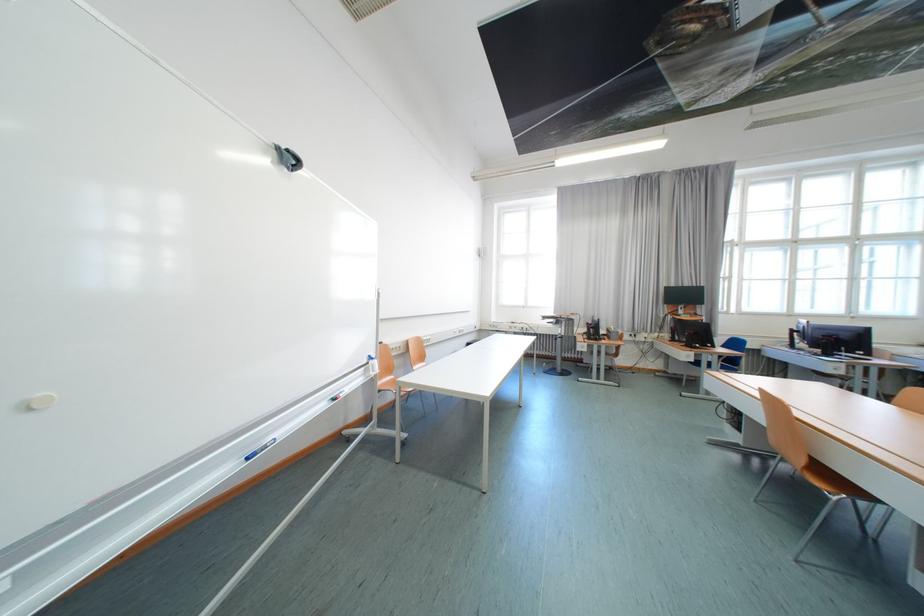
At what (x,y) coordinates should I click in order to perform the action: click on blue whiteboard marker. Please return your answer as a coordinate pair (x, y). The height and width of the screenshot is (616, 924). Looking at the image, I should click on (260, 448).